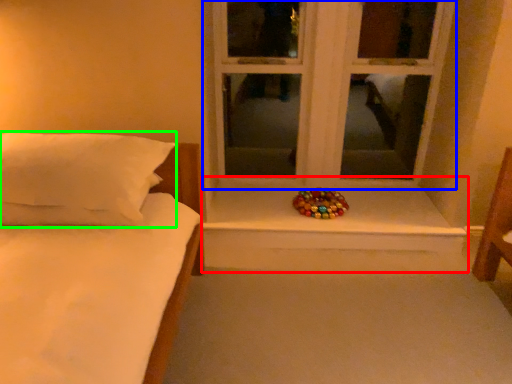
Question: Which object is positioned farthest from window sill (highlighted by a red box)? Select from window (highlighted by a blue box) and pillow (highlighted by a green box).

Choices:
 (A) window
 (B) pillow

Answer: (B)